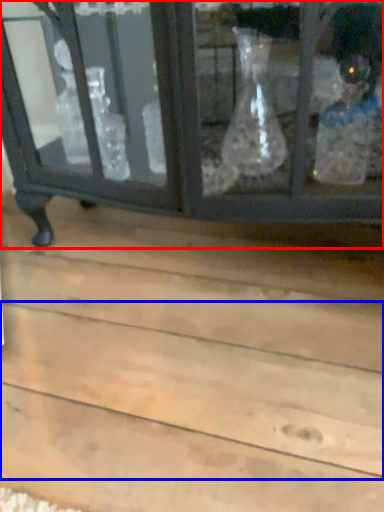
Question: Which of the following is the closest to the observer, furniture (highlighted by a red box) or plank (highlighted by a blue box)?

Choices:
 (A) furniture
 (B) plank

Answer: (B)